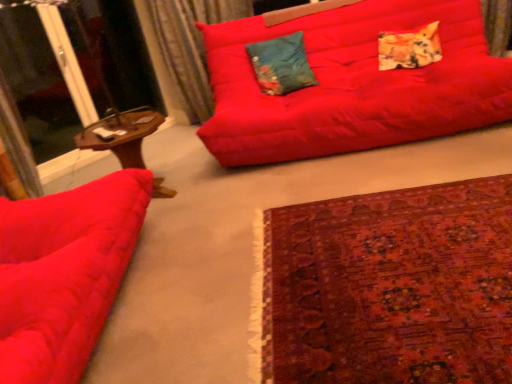
Describe the element at coordinates (186, 47) in the screenshot. I see `velvet curtain at upper left` at that location.

Where is `carpet with intricate patterns at lower right`? carpet with intricate patterns at lower right is located at coordinates (391, 287).

This screenshot has width=512, height=384. Find the location of `woodenwoodentable at left`. woodenwoodentable at left is located at coordinates (122, 134).

At what (x,y) coordinates should I click in order to perform the action: click on teal floral cushion at center, which is the 2th pillow from right to left. Please return your answer as a coordinate pair (x, y). Looking at the image, I should click on (281, 65).

The width and height of the screenshot is (512, 384). What do you see at coordinates (64, 273) in the screenshot?
I see `matte red studio couch at left, which is the first studio couch in front-to-back order` at bounding box center [64, 273].

You are a GUI agent. You are given a task and a screenshot of the screen. Output one action in this format:
    pyautogui.click(x=<x>, y=<y>)
    Task: Click on the matte red studio couch at left, which is the first studio couch in front-to-back order
    The image size is (512, 384).
    Given the screenshot: What is the action you would take?
    pyautogui.click(x=64, y=273)

You are a GUI agent. You are given a task and a screenshot of the screen. Output one action in this format:
    pyautogui.click(x=<x>, y=<y>)
    Task: Click on the textured orange-yellow pillow at upper right, which is the 2th pillow in left-to-right order
    The height and width of the screenshot is (384, 512).
    Given the screenshot: What is the action you would take?
    pyautogui.click(x=409, y=48)

Is teal floral cushion at center, the first pillow in the left-to-right sequence, not near woodenwoodentable at left?

teal floral cushion at center, the first pillow in the left-to-right sequence, is near woodenwoodentable at left, not far away.

How many degrees apart are the facing directions of teal floral cushion at center, which is the 2th pillow from right to left, and woodenwoodentable at left?

The angular difference between teal floral cushion at center, which is the 2th pillow from right to left, and woodenwoodentable at left is 70.4 degrees.

From a real-world perspective, is teal floral cushion at center, the first pillow in the left-to-right sequence, under woodenwoodentable at left?

No, from a real-world perspective, teal floral cushion at center, the first pillow in the left-to-right sequence, is not under woodenwoodentable at left.

Is teal floral cushion at center, the first pillow in the left-to-right sequence, taller or shorter than woodenwoodentable at left?

teal floral cushion at center, the first pillow in the left-to-right sequence, is shorter than woodenwoodentable at left.

Image resolution: width=512 pixels, height=384 pixels. I want to click on plain in front of the velvet curtain at upper left, so click(391, 287).

How different are the orientations of carpet with intricate patterns at lower right and velvet curtain at upper left in degrees?

There is a 49.9-degree angle between the facing directions of carpet with intricate patterns at lower right and velvet curtain at upper left.

From the image's perspective, who appears lower, carpet with intricate patterns at lower right or velvet curtain at upper left?

carpet with intricate patterns at lower right.

Which object is wider, carpet with intricate patterns at lower right or woodenwoodentable at left?

Wider between the two is carpet with intricate patterns at lower right.

Is carpet with intricate patterns at lower right far away from woodenwoodentable at left?

Indeed, carpet with intricate patterns at lower right is not near woodenwoodentable at left.

Considering the relative sizes of carpet with intricate patterns at lower right and woodenwoodentable at left in the image provided, is carpet with intricate patterns at lower right smaller than woodenwoodentable at left?

Indeed, carpet with intricate patterns at lower right has a smaller size compared to woodenwoodentable at left.

How much distance is there between carpet with intricate patterns at lower right and woodenwoodentable at left?

4.23 feet.

This screenshot has width=512, height=384. Identify the location of screen door that is above the textured orange-yellow pillow at upper right, arranged as the first pillow when viewed from the right (from a real-world perspective). (86, 84).

Considering the sizes of objects transparent glass screen door at upper left and textured orange-yellow pillow at upper right, arranged as the first pillow when viewed from the right, in the image provided, who is thinner, transparent glass screen door at upper left or textured orange-yellow pillow at upper right, arranged as the first pillow when viewed from the right,?

transparent glass screen door at upper left is thinner.

Would you consider transparent glass screen door at upper left to be distant from textured orange-yellow pillow at upper right, arranged as the first pillow when viewed from the right?

Yes.

Considering the positions of objects transparent glass screen door at upper left and textured orange-yellow pillow at upper right, arranged as the first pillow when viewed from the right, in the image provided, who is more to the right, transparent glass screen door at upper left or textured orange-yellow pillow at upper right, arranged as the first pillow when viewed from the right,?

From the viewer's perspective, textured orange-yellow pillow at upper right, arranged as the first pillow when viewed from the right, appears more on the right side.

Looking at this image, is velvet curtain at upper left aimed at matte red studio couch at left, which is the first studio couch in front-to-back order?

No, velvet curtain at upper left is not oriented towards matte red studio couch at left, which is the first studio couch in front-to-back order.

Considering the relative positions of velvet curtain at upper left and matte red studio couch at left, which is counted as the 2th studio couch, starting from the back, in the image provided, is velvet curtain at upper left to the left of matte red studio couch at left, which is counted as the 2th studio couch, starting from the back, from the viewer's perspective?

No, velvet curtain at upper left is not to the left of matte red studio couch at left, which is counted as the 2th studio couch, starting from the back.

Between velvet curtain at upper left and matte red studio couch at left, which is the first studio couch in front-to-back order, which one has smaller size?

Smaller between the two is velvet curtain at upper left.

Is teal floral cushion at center, which is the 2th pillow from right to left, not near matte red studio couch at upper center, acting as the first studio couch starting from the back?

No, teal floral cushion at center, which is the 2th pillow from right to left, is not far away from matte red studio couch at upper center, acting as the first studio couch starting from the back.

Is teal floral cushion at center, which is the 2th pillow from right to left, outside of matte red studio couch at upper center, marked as the 2th studio couch in a left-to-right arrangement?

No.

Is point (277, 90) closer to camera compared to point (264, 30)?

Yes, point (277, 90) is closer to viewer.

Would you say woodenwoodentable at left contains teal floral cushion at center, the first pillow in the left-to-right sequence?

No, teal floral cushion at center, the first pillow in the left-to-right sequence, is not inside woodenwoodentable at left.

Is woodenwoodentable at left bigger or smaller than teal floral cushion at center, the first pillow in the left-to-right sequence?

woodenwoodentable at left is bigger than teal floral cushion at center, the first pillow in the left-to-right sequence.

From a real-world perspective, is woodenwoodentable at left above or below teal floral cushion at center, which is the 2th pillow from right to left?

In terms of real-world spatial position, woodenwoodentable at left is below teal floral cushion at center, which is the 2th pillow from right to left.

Can you tell me how much woodenwoodentable at left and teal floral cushion at center, which is the 2th pillow from right to left, differ in facing direction?

They differ by 70.4 degrees in their facing directions.

Locate an element on the screen. the 2nd pillow above the woodenwoodentable at left (from a real-world perspective) is located at coordinates (281, 65).

Locate an element on the screen. This screenshot has height=384, width=512. curtain above the carpet with intricate patterns at lower right (from the image's perspective) is located at coordinates (186, 47).

Looking at the image, which one is located closer to carpet with intricate patterns at lower right, woodenwoodentable at left or matte red studio couch at upper center, acting as the first studio couch starting from the back?

Based on the image, matte red studio couch at upper center, acting as the first studio couch starting from the back, appears to be nearer to carpet with intricate patterns at lower right.

From the image, which object appears to be farther from carpet with intricate patterns at lower right, woodenwoodentable at left or textured orange-yellow pillow at upper right, arranged as the first pillow when viewed from the right?

textured orange-yellow pillow at upper right, arranged as the first pillow when viewed from the right, is further to carpet with intricate patterns at lower right.

Which object lies nearer to the anchor point textured orange-yellow pillow at upper right, arranged as the first pillow when viewed from the right, carpet with intricate patterns at lower right or matte red studio couch at upper center, which is the first studio couch in right-to-left order?

matte red studio couch at upper center, which is the first studio couch in right-to-left order.

From the image, which object appears to be nearer to teal floral cushion at center, the first pillow in the left-to-right sequence, carpet with intricate patterns at lower right or transparent glass screen door at upper left?

carpet with intricate patterns at lower right is positioned closer to the anchor teal floral cushion at center, the first pillow in the left-to-right sequence.

From the image, which object appears to be farther from teal floral cushion at center, the first pillow in the left-to-right sequence, matte red studio couch at upper center, which is the first studio couch in right-to-left order, or matte red studio couch at left, which is counted as the 2th studio couch, starting from the back?

matte red studio couch at left, which is counted as the 2th studio couch, starting from the back, is further to teal floral cushion at center, the first pillow in the left-to-right sequence.

Considering their positions, is teal floral cushion at center, the first pillow in the left-to-right sequence, positioned further to matte red studio couch at left, acting as the first studio couch starting from the left, than textured orange-yellow pillow at upper right, arranged as the first pillow when viewed from the right?

Based on the image, textured orange-yellow pillow at upper right, arranged as the first pillow when viewed from the right, appears to be further to matte red studio couch at left, acting as the first studio couch starting from the left.

Considering their positions, is woodenwoodentable at left positioned closer to matte red studio couch at upper center, placed as the second studio couch when sorted from front to back, than teal floral cushion at center, the first pillow in the left-to-right sequence?

The object closer to matte red studio couch at upper center, placed as the second studio couch when sorted from front to back, is teal floral cushion at center, the first pillow in the left-to-right sequence.

Looking at this image, based on their spatial positions, is matte red studio couch at upper center, which is the first studio couch in right-to-left order, or velvet curtain at upper left closer to transparent glass screen door at upper left?

velvet curtain at upper left.

You are a GUI agent. You are given a task and a screenshot of the screen. Output one action in this format:
    pyautogui.click(x=<x>, y=<y>)
    Task: Click on the table located between matte red studio couch at left, which is the first studio couch in front-to-back order, and transparent glass screen door at upper left in the depth direction
    The height and width of the screenshot is (384, 512).
    Given the screenshot: What is the action you would take?
    122,134

At what (x,y) coordinates should I click in order to perform the action: click on pillow between velvet curtain at upper left and matte red studio couch at upper center, acting as the first studio couch starting from the back, from left to right. Please return your answer as a coordinate pair (x, y). This screenshot has height=384, width=512. Looking at the image, I should click on (281, 65).

The height and width of the screenshot is (384, 512). I want to click on curtain situated between transparent glass screen door at upper left and textured orange-yellow pillow at upper right, which is the 2th pillow in left-to-right order, from left to right, so click(x=186, y=47).

The height and width of the screenshot is (384, 512). I want to click on table positioned between carpet with intricate patterns at lower right and velvet curtain at upper left from near to far, so click(122, 134).